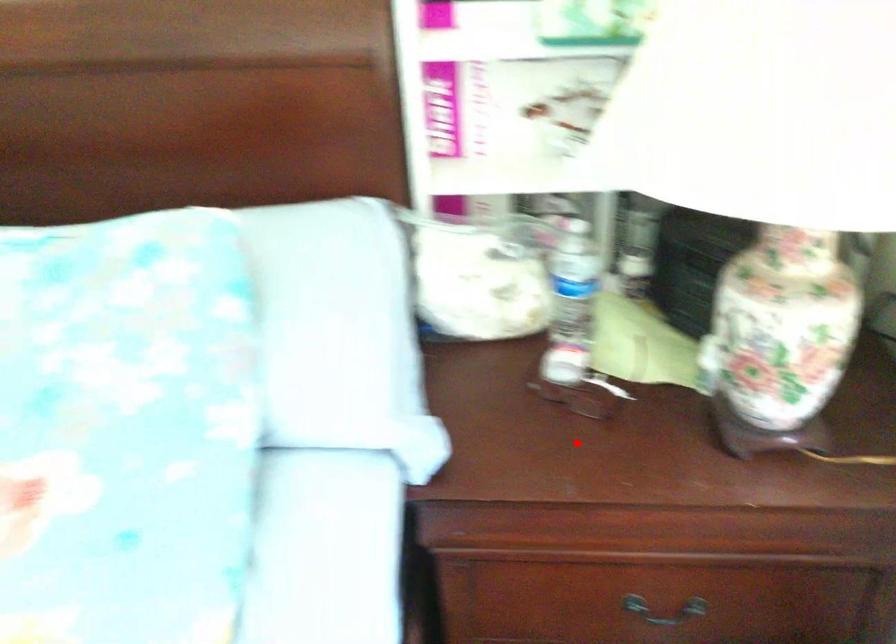
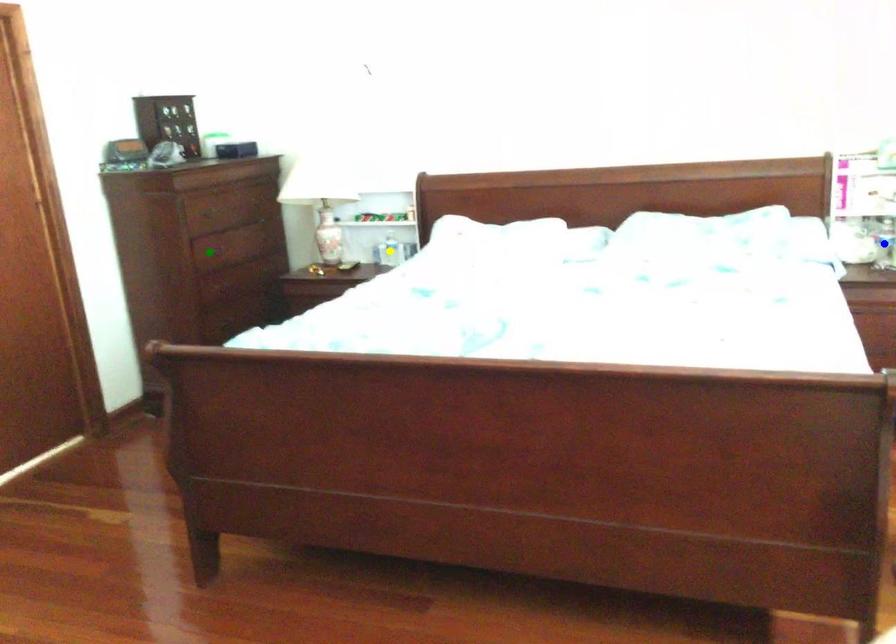
Question: I am providing you with two images of the same scene from different viewpoints. A red point is marked on the first image. You are given multiple points on the second image. Can you choose the point in image 2 that corresponds to the point in image 1?

Choices:
 (A) blue point
 (B) yellow point
 (C) green point

Answer: (A)